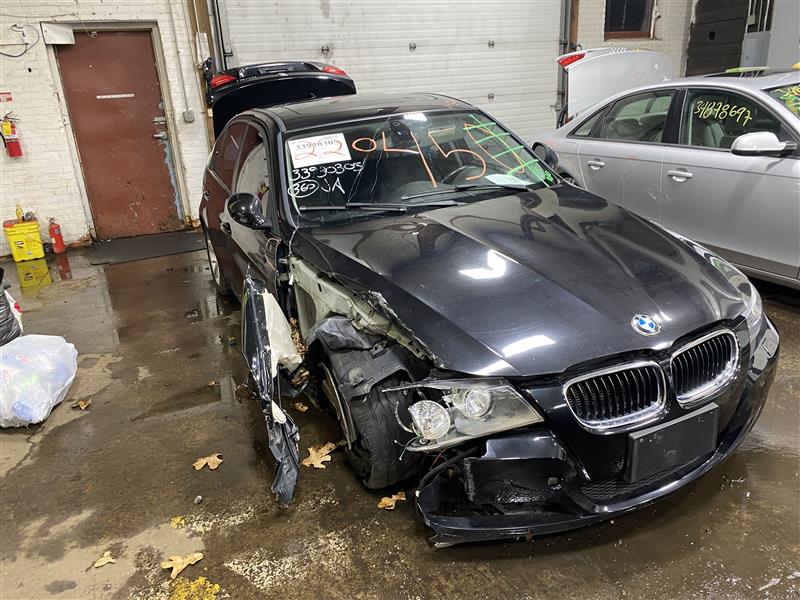
Locate an element on the screen. This screenshot has width=800, height=600. door is located at coordinates (125, 157).